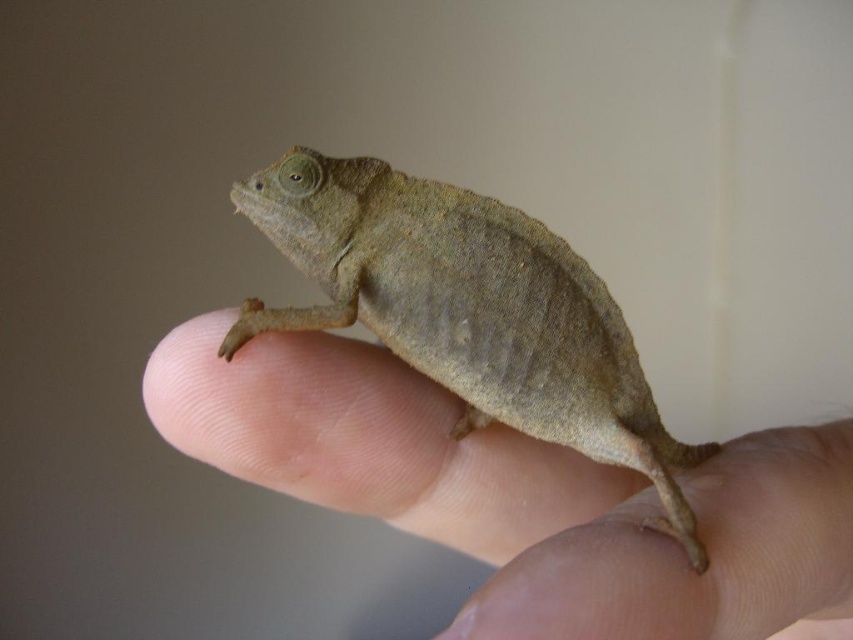
Does brown textured lizard at center have a lesser width compared to matte brown chameleon at center?

In fact, brown textured lizard at center might be wider than matte brown chameleon at center.

Which is more to the left, brown textured lizard at center or matte brown chameleon at center?

brown textured lizard at center is more to the left.

Is point (339, 189) farther from viewer compared to point (503, 588)?

Yes, point (339, 189) is behind point (503, 588).

I want to click on brown textured lizard at center, so click(467, 308).

Which of these two, brown matte chameleon at center or matte brown chameleon at center, stands shorter?

matte brown chameleon at center is shorter.

Is point (663, 602) farther from camera compared to point (558, 564)?

No, (663, 602) is in front of (558, 564).

Find the location of a particular element. The width and height of the screenshot is (853, 640). brown matte chameleon at center is located at coordinates (521, 493).

Can you confirm if brown matte chameleon at center is wider than brown textured lizard at center?

Indeed, brown matte chameleon at center has a greater width compared to brown textured lizard at center.

Measure the distance between point (776, 541) and camera.

They are 73.07 centimeters apart.

Locate an element on the screen. The width and height of the screenshot is (853, 640). brown matte chameleon at center is located at coordinates (521, 493).